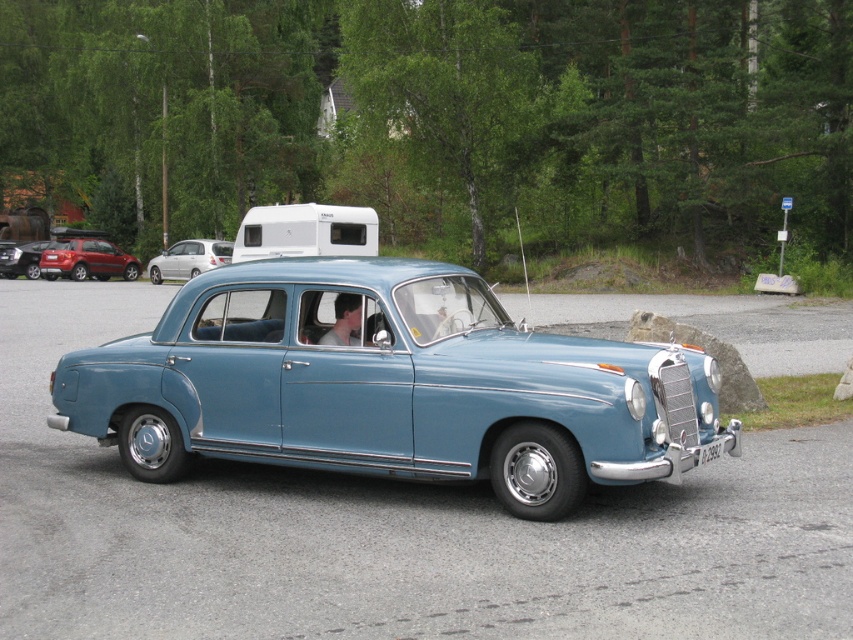
From the picture: You are a parking attendant trying to fit a new car into a parking spot that is exactly the same width as the black plastic license plate at center. Can the light blue metallic car at center fit into this spot without overlapping the sides?

The light blue metallic car at center is wider than the black plastic license plate at center, so it cannot fit into a parking spot that matches the license plate width without overlapping the sides.